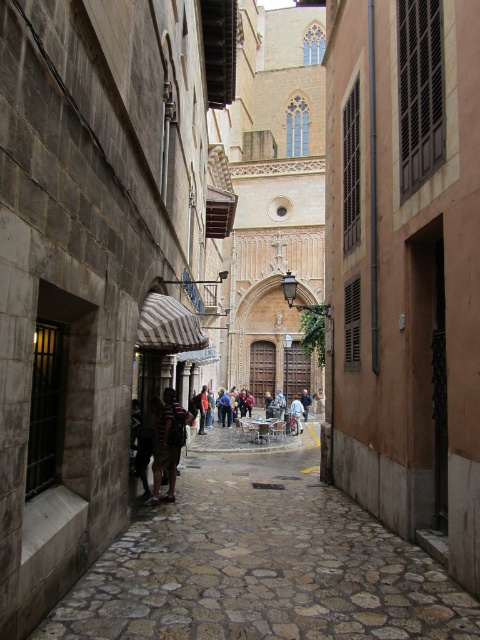
You are standing at the entrance of the shop with the striped awning on the left side of the narrow cobblestone street. You want to walk straight ahead to the end of the street. Which direction should you face to follow the stone cobblestone path at center represented by point (261, 563)?

To follow the stone cobblestone path at center represented by point (261, 563), you should face directly forward along the street since the path is centered and leads straight ahead toward the end of the narrow cobblestone street.

You are a tourist walking on the stone cobblestone path at center in the narrow street. You want to pick up the light brown leather jacket at center. Can you reach it without stepping off the path?

The stone cobblestone path at center is above the light brown leather jacket at center, so you can reach it while standing on the path.

You are standing at the entrance of the shop on the left side of the street. You want to walk to the grand structure in the background. According to the coordinates provided, where exactly is the stone cobblestone path at center located that you should follow?

The stone cobblestone path at center is located at coordinates point (261, 563). You should follow this path to reach the grand structure in the background.